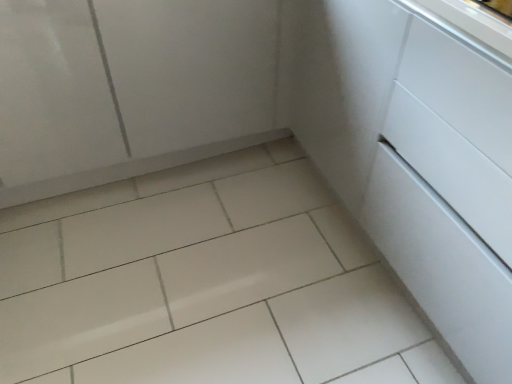
Find the location of `white glossy cabinet at upper left`. white glossy cabinet at upper left is located at coordinates (140, 93).

Considering the relative sizes of white glossy cabinet at upper left and white glossy tile at center in the image provided, is white glossy cabinet at upper left taller than white glossy tile at center?

Indeed, white glossy cabinet at upper left has a greater height compared to white glossy tile at center.

Where is `ceramic tile on the right of white glossy cabinet at upper left`? This screenshot has height=384, width=512. ceramic tile on the right of white glossy cabinet at upper left is located at coordinates (204, 284).

Can you tell me how much white glossy cabinet at upper left and white glossy tile at center differ in facing direction?

0.0553 degrees.

Is white glossy tile at center with white glossy drawer at center-right?

white glossy tile at center and white glossy drawer at center-right are not in contact.

Is white glossy tile at center outside of white glossy drawer at center-right?

Yes, white glossy tile at center is located beyond the bounds of white glossy drawer at center-right.

You are a GUI agent. You are given a task and a screenshot of the screen. Output one action in this format:
    pyautogui.click(x=<x>, y=<y>)
    Task: Click on the ceramic tile directly beneath the white glossy drawer at center-right (from a real-world perspective)
    The width and height of the screenshot is (512, 384).
    Given the screenshot: What is the action you would take?
    pyautogui.click(x=204, y=284)

Which is in front, white glossy tile at center or white glossy drawer at center-right?

white glossy drawer at center-right is in front.

Is the surface of white glossy cabinet at upper left in direct contact with white glossy drawer at center-right?

No.

Is point (16, 190) farther from viewer compared to point (457, 55)?

Yes, it is behind point (457, 55).

Is white glossy cabinet at upper left taller or shorter than white glossy drawer at center-right?

In the image, white glossy cabinet at upper left appears to be shorter than white glossy drawer at center-right.

At what (x,y) coordinates should I click in order to perform the action: click on drawer above the white glossy cabinet at upper left (from a real-world perspective). Please return your answer as a coordinate pair (x, y). Looking at the image, I should click on (450, 195).

Does point (477, 140) come behind point (53, 375)?

No, it is in front of (53, 375).

From the picture: Does white glossy drawer at center-right have a greater width compared to white glossy tile at center?

In fact, white glossy drawer at center-right might be narrower than white glossy tile at center.

From the image's perspective, is white glossy drawer at center-right located above white glossy tile at center?

Indeed, from the image's perspective, white glossy drawer at center-right is shown above white glossy tile at center.

From a real-world perspective, is white glossy drawer at center-right physically above white glossy tile at center?

Yes.

Between white glossy drawer at center-right and white glossy cabinet at upper left, which one appears on the left side from the viewer's perspective?

From the viewer's perspective, white glossy cabinet at upper left appears more on the left side.

Which object is further away from the camera, white glossy drawer at center-right or white glossy cabinet at upper left?

white glossy cabinet at upper left is behind.

Can white glossy cabinet at upper left be found inside white glossy drawer at center-right?

No.

Between white glossy tile at center and white glossy cabinet at upper left, which one has smaller size?

Smaller between the two is white glossy tile at center.

From the image's perspective, is white glossy tile at center under white glossy cabinet at upper left?

Correct, white glossy tile at center appears lower than white glossy cabinet at upper left in the image.

Is white glossy tile at center positioned far away from white glossy cabinet at upper left?

They are positioned close to each other.

Between white glossy tile at center and white glossy cabinet at upper left, which one appears on the left side from the viewer's perspective?

white glossy cabinet at upper left is more to the left.

In order to click on ceramic tile beneath the white glossy cabinet at upper left (from a real-world perspective) in this screenshot , I will do `click(204, 284)`.

Where is `drawer above the white glossy tile at center (from a real-world perspective)`? The image size is (512, 384). drawer above the white glossy tile at center (from a real-world perspective) is located at coordinates (450, 195).

Estimate the real-world distances between objects in this image. Which object is further from white glossy tile at center, white glossy drawer at center-right or white glossy cabinet at upper left?

Among the two, white glossy drawer at center-right is located further to white glossy tile at center.

When comparing their distances from white glossy tile at center, does white glossy cabinet at upper left or white glossy drawer at center-right seem closer?

Among the two, white glossy cabinet at upper left is located nearer to white glossy tile at center.

When comparing their distances from white glossy drawer at center-right, does white glossy tile at center or white glossy cabinet at upper left seem closer?

The object closer to white glossy drawer at center-right is white glossy tile at center.

Based on their spatial positions, is white glossy cabinet at upper left or white glossy tile at center closer to white glossy drawer at center-right?

white glossy tile at center is closer to white glossy drawer at center-right.

When comparing their distances from white glossy cabinet at upper left, does white glossy tile at center or white glossy drawer at center-right seem further?

The object further to white glossy cabinet at upper left is white glossy drawer at center-right.

From the image, which object appears to be farther from white glossy cabinet at upper left, white glossy drawer at center-right or white glossy tile at center?

white glossy drawer at center-right.

Where is `ceramic tile located between white glossy cabinet at upper left and white glossy drawer at center-right in the left-right direction`? The width and height of the screenshot is (512, 384). ceramic tile located between white glossy cabinet at upper left and white glossy drawer at center-right in the left-right direction is located at coordinates (204, 284).